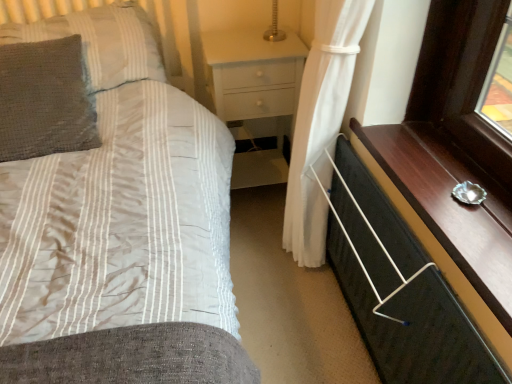
Question: Is the position of gray textured pillow at left, acting as the first pillow starting from the bottom, more distant than that of white glossy nightstand at center?

Choices:
 (A) yes
 (B) no

Answer: (B)

Question: From the image's perspective, does gray textured pillow at left, acting as the first pillow starting from the bottom, appear higher than white glossy nightstand at center?

Choices:
 (A) no
 (B) yes

Answer: (B)

Question: Is there a large distance between gray textured pillow at left, which ranks as the 2th pillow in top-to-bottom order, and white glossy nightstand at center?

Choices:
 (A) no
 (B) yes

Answer: (A)

Question: From a real-world perspective, is gray textured pillow at left, acting as the first pillow starting from the bottom, below white glossy nightstand at center?

Choices:
 (A) yes
 (B) no

Answer: (B)

Question: Can white glossy nightstand at center be found inside gray textured pillow at left, acting as the first pillow starting from the bottom?

Choices:
 (A) no
 (B) yes

Answer: (A)

Question: Is white glossy nightstand at center at the back of gray textured pillow at left, which ranks as the 2th pillow in top-to-bottom order?

Choices:
 (A) no
 (B) yes

Answer: (A)

Question: Does matte striped fabric bed at center turn towards gray textured pillow at left, acting as the first pillow starting from the bottom?

Choices:
 (A) no
 (B) yes

Answer: (A)

Question: Is matte striped fabric bed at center closer to camera compared to gray textured pillow at left, which ranks as the 2th pillow in top-to-bottom order?

Choices:
 (A) yes
 (B) no

Answer: (A)

Question: From a real-world perspective, is matte striped fabric bed at center on gray textured pillow at left, which ranks as the 2th pillow in top-to-bottom order?

Choices:
 (A) no
 (B) yes

Answer: (A)

Question: Is matte striped fabric bed at center to the left of gray textured pillow at left, acting as the first pillow starting from the bottom, from the viewer's perspective?

Choices:
 (A) no
 (B) yes

Answer: (A)

Question: From the image's perspective, is matte striped fabric bed at center under gray textured pillow at left, which ranks as the 2th pillow in top-to-bottom order?

Choices:
 (A) yes
 (B) no

Answer: (A)

Question: Is the depth of matte striped fabric bed at center greater than that of gray textured pillow at left, acting as the first pillow starting from the bottom?

Choices:
 (A) no
 (B) yes

Answer: (A)

Question: From the image's perspective, is gray textured pillow at left, which ranks as the 2th pillow in top-to-bottom order, below black fabric chest of drawers at lower right?

Choices:
 (A) yes
 (B) no

Answer: (B)